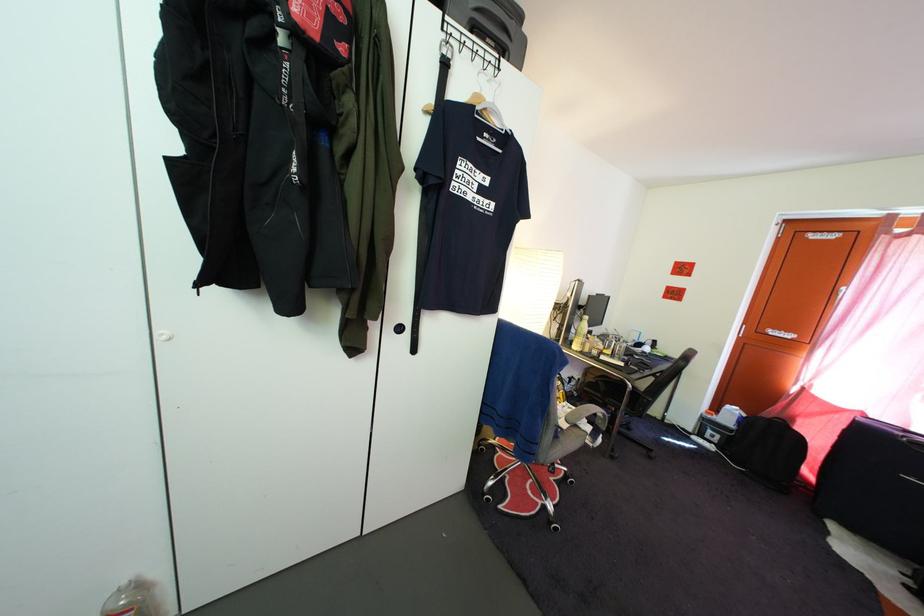
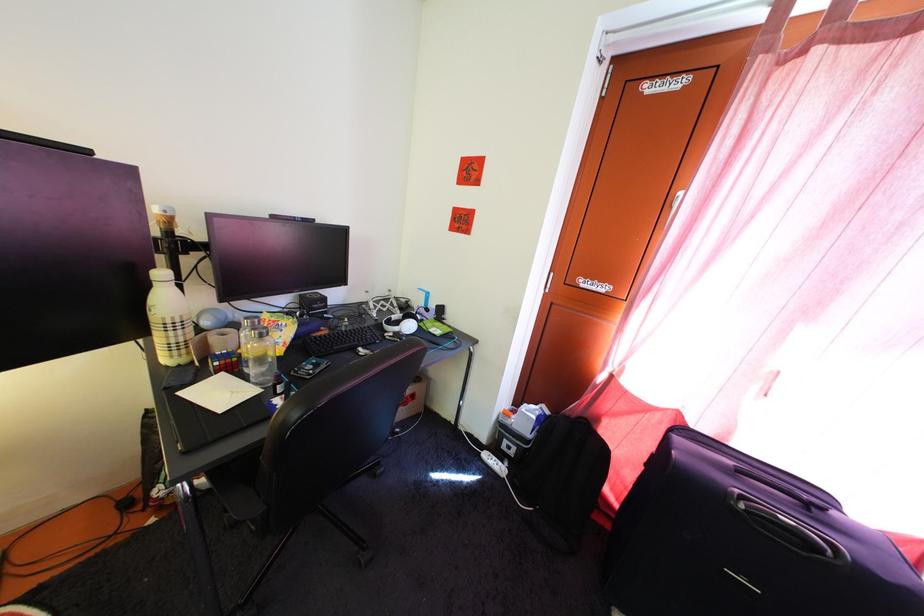
The point at [699,442] is marked in the first image. Where is the corresponding point in the second image?

(492, 456)